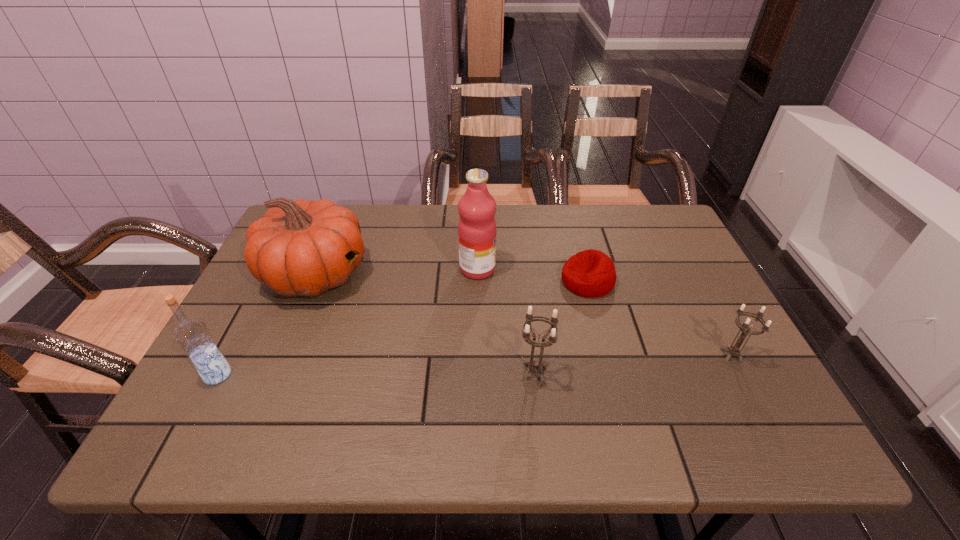
Identify the location of blank space at the far right corner of the desktop. (682, 246).

At what (x,y) coordinates should I click in order to perform the action: click on vacant region between the vodka and the second shortest object. Please return your answer as a coordinate pair (x, y). This screenshot has width=960, height=540. Looking at the image, I should click on (474, 366).

At what (x,y) coordinates should I click in order to perform the action: click on free space between the right candle holder and the pumpkin. Please return your answer as a coordinate pair (x, y). The height and width of the screenshot is (540, 960). Looking at the image, I should click on (523, 315).

Find the location of a particular element. The width and height of the screenshot is (960, 540). free area in between the shorter candle holder and the third object from left to right is located at coordinates (605, 313).

This screenshot has width=960, height=540. Identify the location of vacant space in between the fourth object from left to right and the vodka. (376, 374).

The image size is (960, 540). I want to click on free space between the rightmost object and the shortest object, so click(660, 319).

You are a GUI agent. You are given a task and a screenshot of the screen. Output one action in this format:
    pyautogui.click(x=<x>, y=<y>)
    Task: Click on the vacant space in between the tallest object and the taller candle holder
    The image size is (960, 540).
    Given the screenshot: What is the action you would take?
    pyautogui.click(x=506, y=321)

Where is `unoccupied area between the pumpkin and the third shortest object`? unoccupied area between the pumpkin and the third shortest object is located at coordinates (425, 323).

Locate an element on the screen. This screenshot has width=960, height=540. free space that is in between the second object from right to left and the tallest object is located at coordinates (533, 275).

Identify the location of blank region between the tallest object and the pumpkin. Image resolution: width=960 pixels, height=540 pixels. (396, 272).